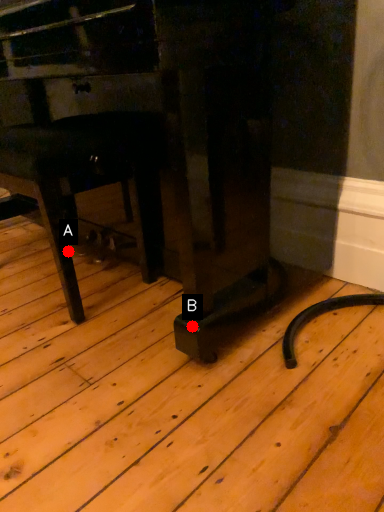
Question: Two points are circled on the image, labeled by A and B beside each circle. Which point is farther from the camera taking this photo?

Choices:
 (A) A is further
 (B) B is further

Answer: (A)